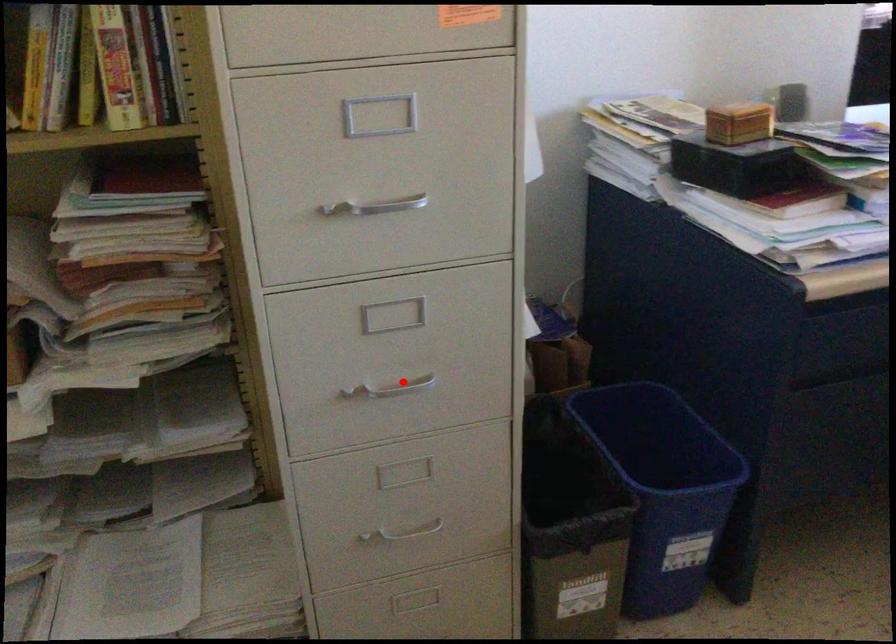
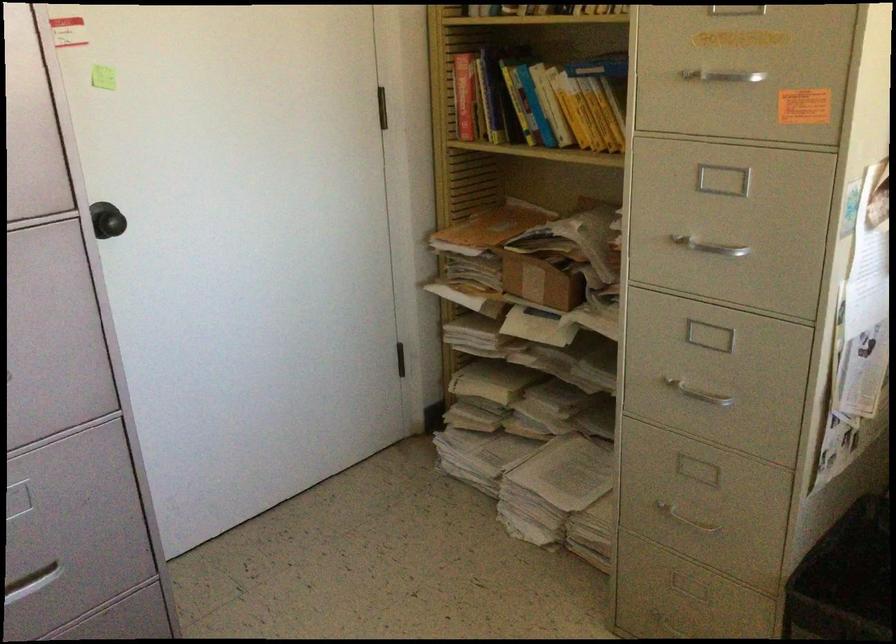
Locate, in the second image, the point that corresponds to the highlighted location in the first image.

(699, 391)